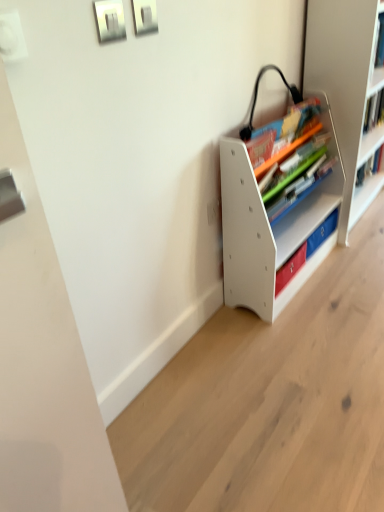
Question: Is white plastic bookshelf at right, the first shelf positioned from the right, situated inside matte plastic books at center or outside?

Choices:
 (A) outside
 (B) inside

Answer: (A)

Question: In the image, is white plastic bookshelf at right, the first shelf positioned from the right, on the left side or the right side of matte plastic books at center?

Choices:
 (A) left
 (B) right

Answer: (B)

Question: Considering the real-world distances, which object is farthest from the matte plastic books at center?

Choices:
 (A) white matte bookshelf at center, which is the first shelf from left to right
 (B) white plastic bookshelf at right, the first shelf positioned from the right

Answer: (B)

Question: Based on their relative distances, which object is nearer to the white plastic bookshelf at right, which is counted as the 2th shelf, starting from the left?

Choices:
 (A) matte plastic books at center
 (B) white matte bookshelf at center, which is the first shelf from left to right

Answer: (A)